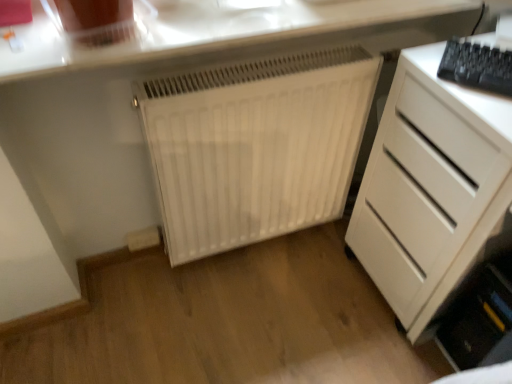
Where is `blank space above white glossy countertop at upper center (from a real-world perspective)`? This screenshot has height=384, width=512. blank space above white glossy countertop at upper center (from a real-world perspective) is located at coordinates (218, 17).